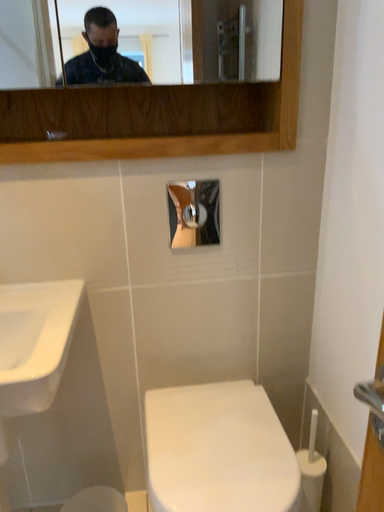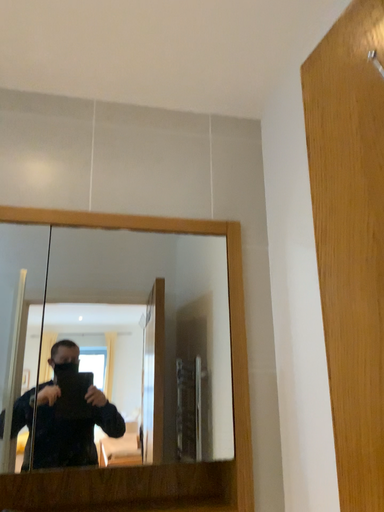
Question: How did the camera likely rotate when shooting the video?

Choices:
 (A) rotated upward
 (B) rotated downward

Answer: (A)